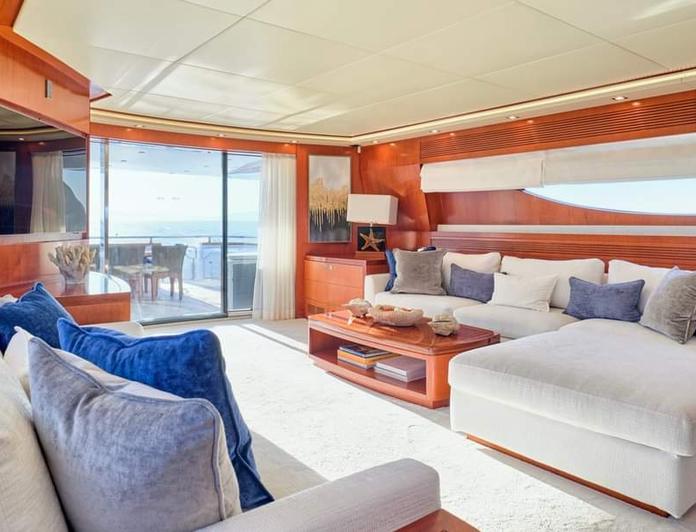
Image resolution: width=696 pixels, height=532 pixels. Identify the location of ceiling. (198, 55).